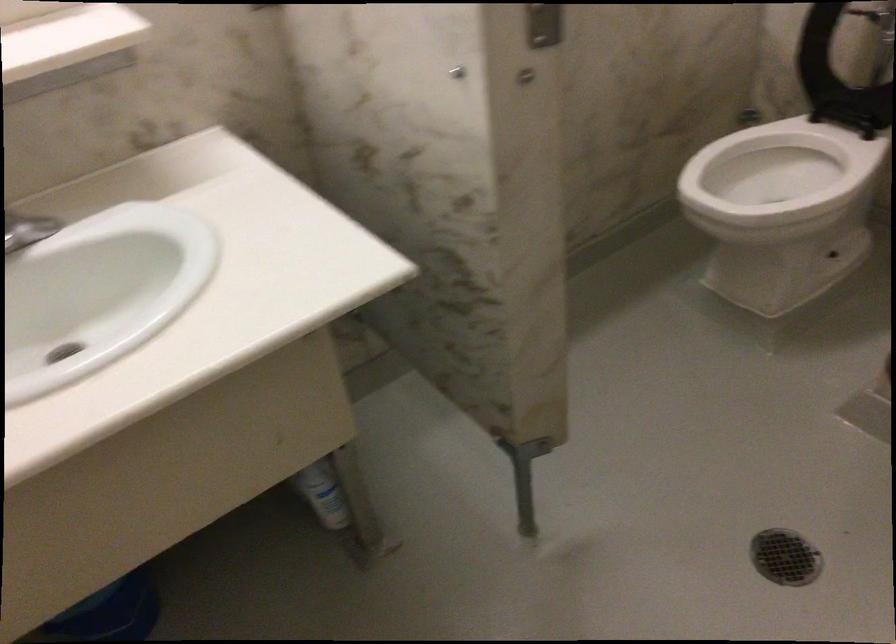
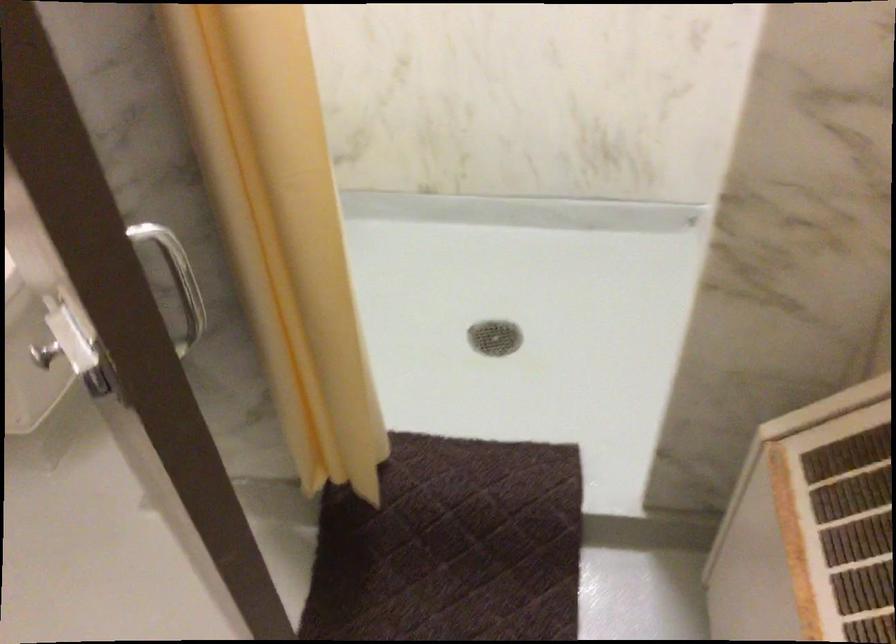
Question: The first image is from the beginning of the video and the second image is from the end. How did the camera likely rotate when shooting the video?

Choices:
 (A) Left
 (B) Right
 (C) Up
 (D) Down

Answer: (B)